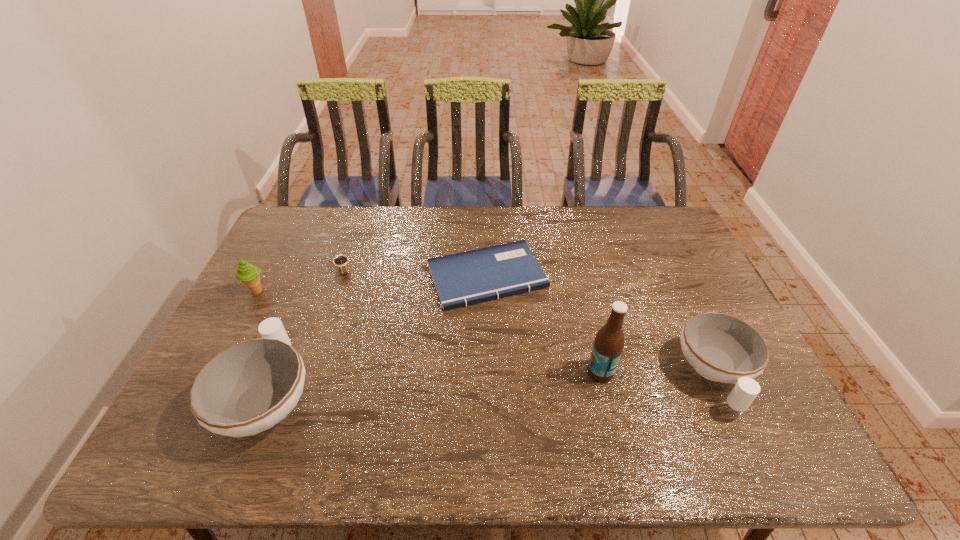
Locate an element on the screen. Image resolution: width=960 pixels, height=540 pixels. free space located 0.200m on the side with the handle of the taller chinaware is located at coordinates (309, 296).

Find the location of a particular element. vacant area situated 0.280m on the back of the watch is located at coordinates (363, 211).

The width and height of the screenshot is (960, 540). I want to click on vacant space located 0.060m on the right of the icecream, so click(x=287, y=292).

Where is `free region located on the left of the paperback book`? This screenshot has height=540, width=960. free region located on the left of the paperback book is located at coordinates (376, 276).

The image size is (960, 540). Find the location of `free space located 0.050m on the right of the tallest object`. free space located 0.050m on the right of the tallest object is located at coordinates (634, 372).

You are a GUI agent. You are given a task and a screenshot of the screen. Output one action in this format:
    pyautogui.click(x=<x>, y=<y>)
    Task: Click on the chinaware positioned at the left edge
    
    Given the screenshot: What is the action you would take?
    pyautogui.click(x=251, y=386)

You are a GUI agent. You are given a task and a screenshot of the screen. Output one action in this format:
    pyautogui.click(x=<x>, y=<y>)
    Task: Click on the icecream located at the left edge
    The image size is (960, 540).
    Given the screenshot: What is the action you would take?
    pyautogui.click(x=248, y=274)

In order to click on object situated at the right edge in this screenshot , I will do `click(722, 348)`.

Locate an element on the screen. The height and width of the screenshot is (540, 960). object located at the near left corner is located at coordinates (251, 386).

Where is `object located in the near right corner section of the desktop`? The image size is (960, 540). object located in the near right corner section of the desktop is located at coordinates (722, 348).